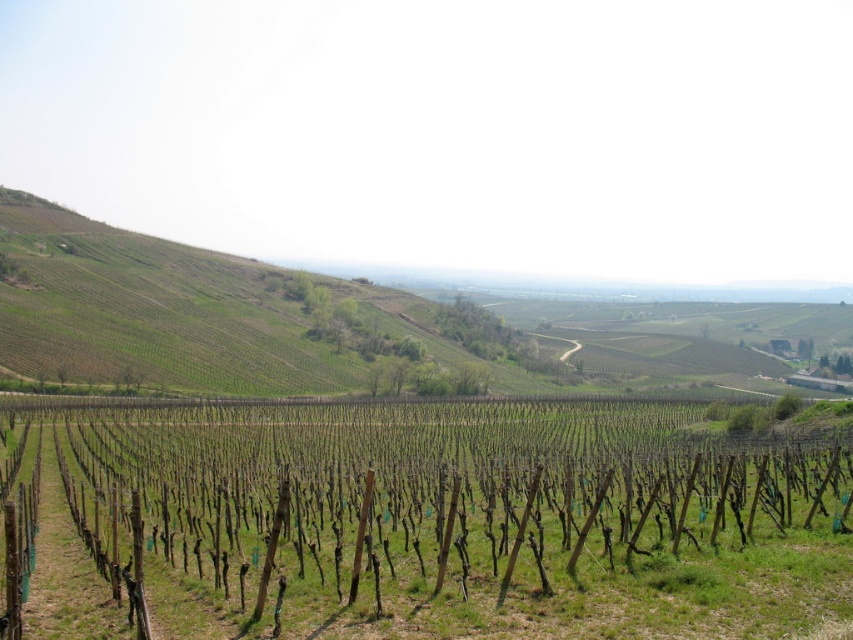
Question: Does green wood pole at center come behind green grassy hillside at upper left?

Choices:
 (A) yes
 (B) no

Answer: (B)

Question: Observing the image, what is the correct spatial positioning of green wood pole at center in reference to green grassy hillside at upper left?

Choices:
 (A) above
 (B) below

Answer: (B)

Question: Is green wood pole at center thinner than green grassy hillside at upper left?

Choices:
 (A) yes
 (B) no

Answer: (A)

Question: Which point appears closest to the camera in this image?

Choices:
 (A) (195, 326)
 (B) (93, 605)

Answer: (B)

Question: Which of the following is the closest to the observer?

Choices:
 (A) click(x=726, y=582)
 (B) click(x=131, y=317)

Answer: (A)

Question: Which of the following is the farthest from the observer?

Choices:
 (A) (460, 461)
 (B) (161, 244)

Answer: (B)